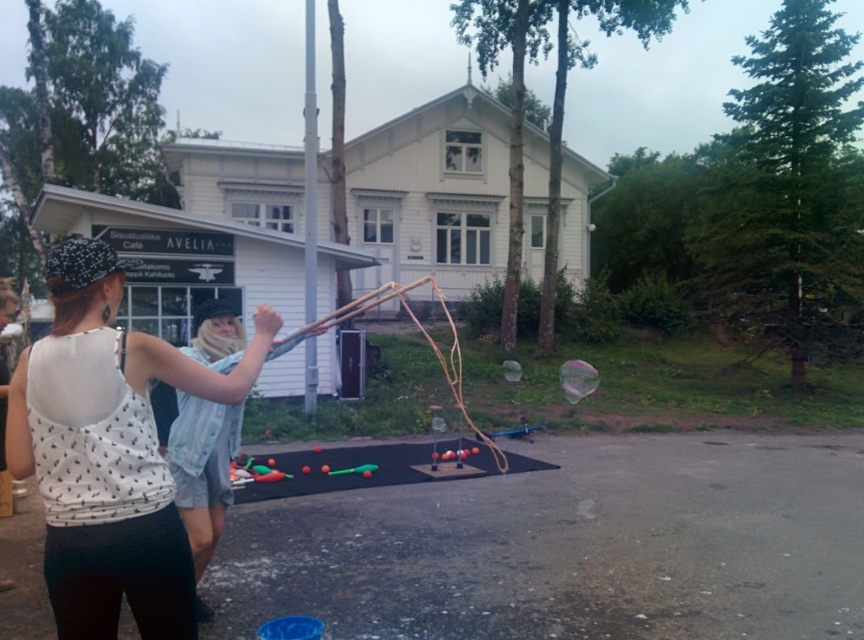
Can you confirm if white matte tank top at center is positioned above denim shorts at center?

Indeed, white matte tank top at center is positioned over denim shorts at center.

Who is more distant from viewer, [81,388] or [234,320]?

Positioned behind is point [234,320].

Locate an element on the screen. This screenshot has width=864, height=640. white matte tank top at center is located at coordinates (109, 451).